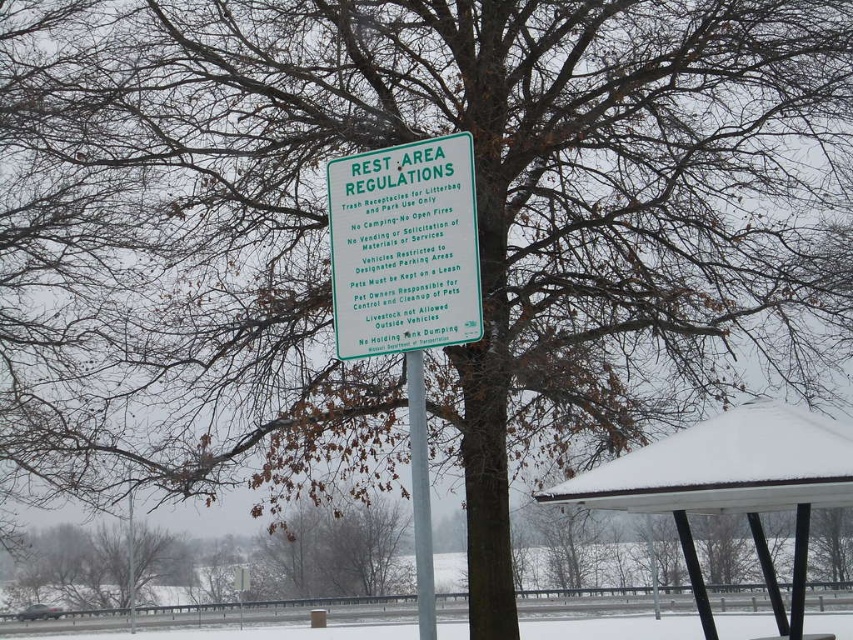
Question: Which point is farther to the camera?

Choices:
 (A) silver metallic pole at center
 (B) white snow-covered bus stop at lower right

Answer: (B)

Question: Is white snow-covered bus stop at lower right smaller than silver metallic pole at center?

Choices:
 (A) no
 (B) yes

Answer: (A)

Question: Is green plastic sign at center in front of silver metallic pole at center?

Choices:
 (A) yes
 (B) no

Answer: (B)

Question: Which point appears closest to the camera in this image?

Choices:
 (A) (407, 365)
 (B) (453, 273)

Answer: (B)

Question: Which point appears farthest from the camera in this image?

Choices:
 (A) (408, 154)
 (B) (419, 524)
 (C) (705, 456)

Answer: (C)

Question: Can you confirm if white snow-covered bus stop at lower right is smaller than silver metallic pole at center?

Choices:
 (A) no
 (B) yes

Answer: (A)